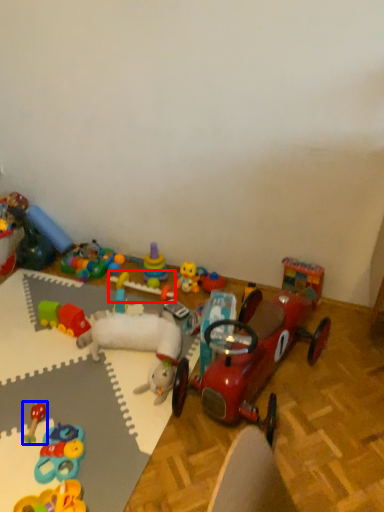
Question: Which object is further to the camera taking this photo, toy (highlighted by a red box) or toy (highlighted by a blue box)?

Choices:
 (A) toy
 (B) toy

Answer: (A)